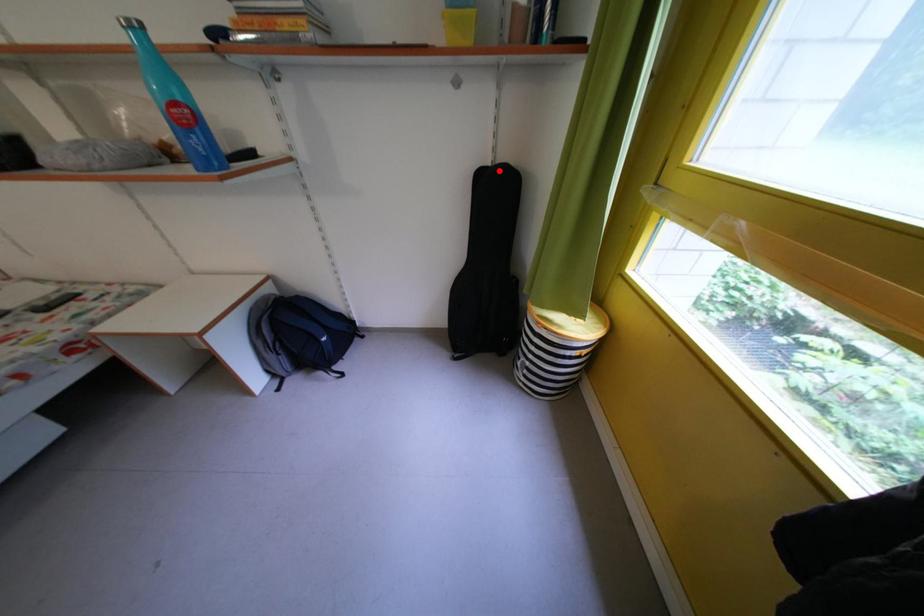
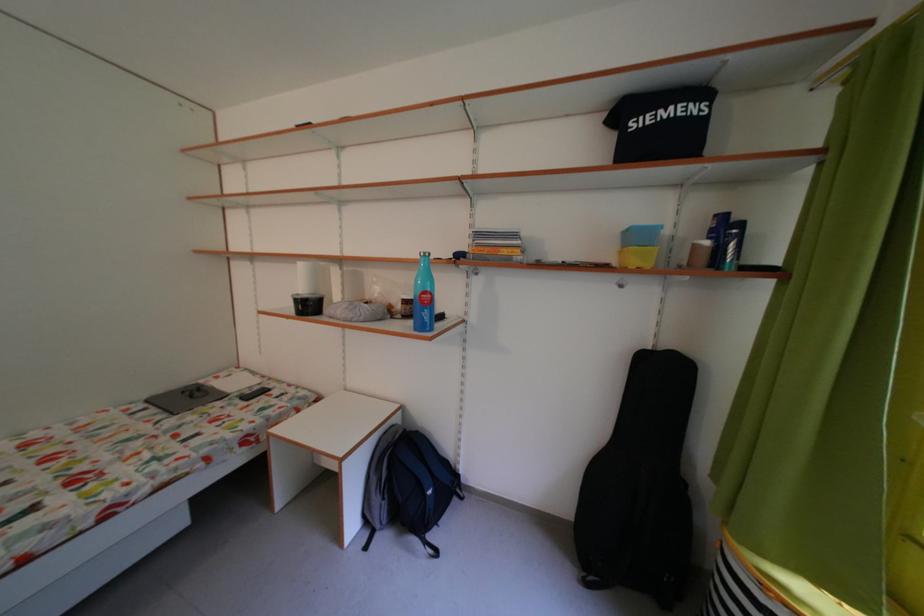
Question: I am providing you with two images of the same scene from different viewpoints. In image1, a red point is highlighted. Considering the same 3D point in image2, which of the following is correct?

Choices:
 (A) It is closer
 (B) It is farther

Answer: (B)